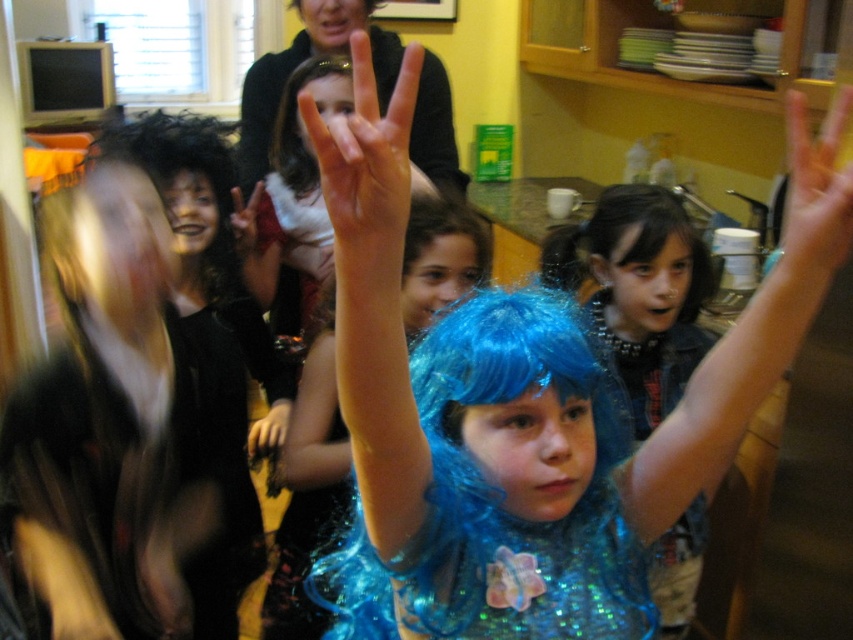
Question: Which object is the closest to the smooth skin hand at upper right?

Choices:
 (A) dark brown silky hair at center
 (B) black velvet wig at left
 (C) blue glitter wig at center
 (D) smooth skin hand at center

Answer: (D)

Question: Is blue sequined wig at center smaller than dark brown shiny hair at center?

Choices:
 (A) no
 (B) yes

Answer: (A)

Question: Is black velvet wig at left smaller than smooth skin hand at upper right?

Choices:
 (A) yes
 (B) no

Answer: (B)

Question: Which point is closer to the camera taking this photo?

Choices:
 (A) (250, 456)
 (B) (196, 260)
 (C) (590, 214)

Answer: (A)

Question: Which point is farther to the camera?

Choices:
 (A) blue sequined wig at center
 (B) smooth skin hand at upper right
 (C) dark brown silky hair at center
 (D) smooth skin hand at center

Answer: (C)

Question: Is matte black wig at center above smooth black glove at center?

Choices:
 (A) yes
 (B) no

Answer: (A)